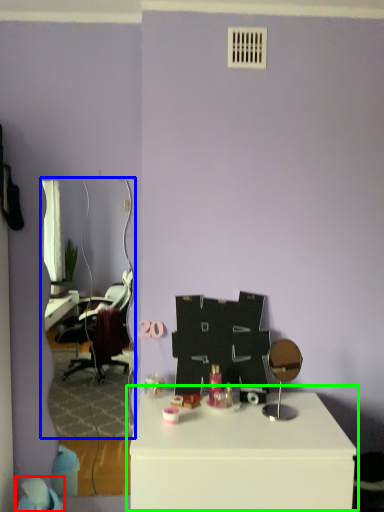
Question: Which is nearer to the bean bag chair (highlighted by a red box)? mirror (highlighted by a blue box) or table (highlighted by a green box).

Choices:
 (A) mirror
 (B) table

Answer: (B)